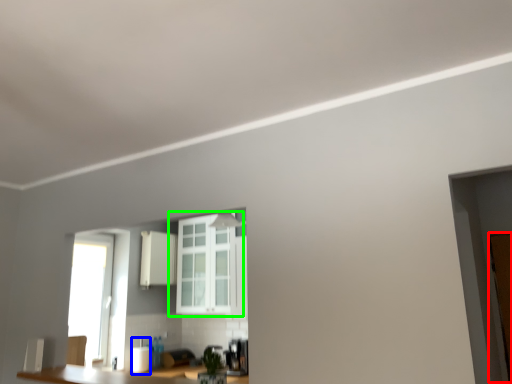
Question: Which object is the farthest from door (highlighted by a red box)? Choose among these: appliance (highlighted by a blue box) or window (highlighted by a green box).

Choices:
 (A) appliance
 (B) window

Answer: (A)